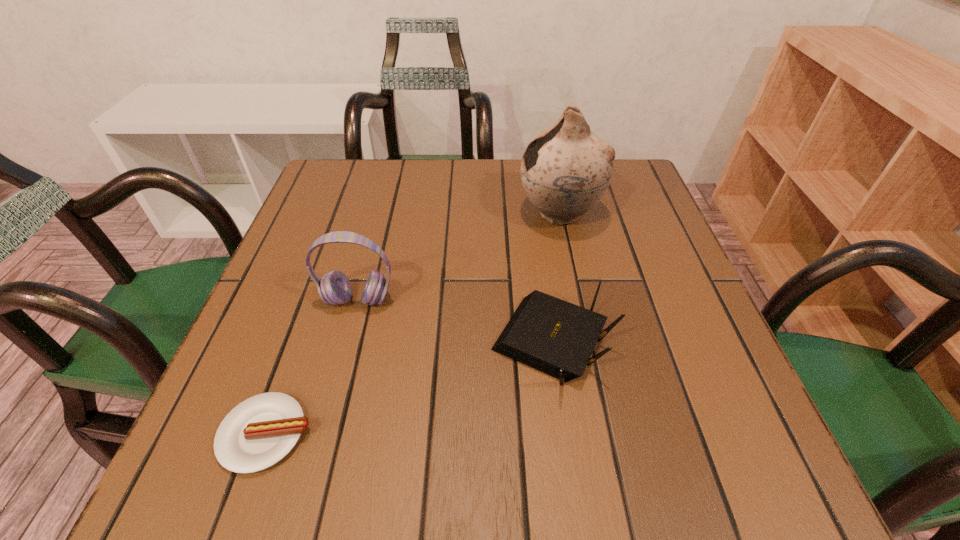
Find the location of a particular element. The width and height of the screenshot is (960, 540). the farthest object is located at coordinates (565, 170).

Locate an element on the screen. The image size is (960, 540). the tallest object is located at coordinates (565, 170).

Where is `the second tallest object`? The height and width of the screenshot is (540, 960). the second tallest object is located at coordinates (334, 288).

Image resolution: width=960 pixels, height=540 pixels. Find the location of `router`. router is located at coordinates (551, 335).

Where is `sausage`? sausage is located at coordinates (259, 432).

I want to click on vacant space located 0.180m from the spout of the tallest object, so click(x=440, y=213).

Where is `blank area located 0.070m from the spout of the tallest object`? blank area located 0.070m from the spout of the tallest object is located at coordinates (487, 213).

Locate an element on the screen. The image size is (960, 540). vacant space located from the spout of the tallest object is located at coordinates (410, 213).

Identify the location of vacant area situated on the headband and ear cups of the headset. The width and height of the screenshot is (960, 540). (326, 421).

Locate an element on the screen. The height and width of the screenshot is (540, 960). free location located on the back of the second shortest object is located at coordinates (539, 246).